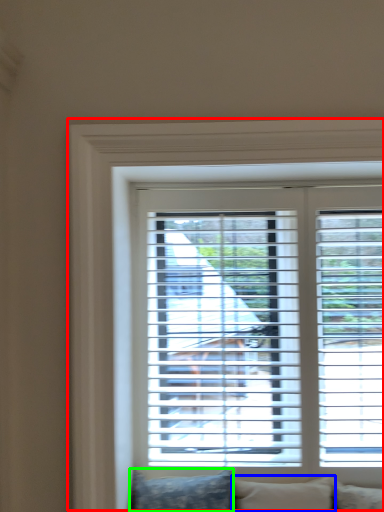
Question: Which object is positioned farthest from window (highlighted by a red box)? Select from pillow (highlighted by a blue box) and pillow (highlighted by a green box).

Choices:
 (A) pillow
 (B) pillow

Answer: (A)